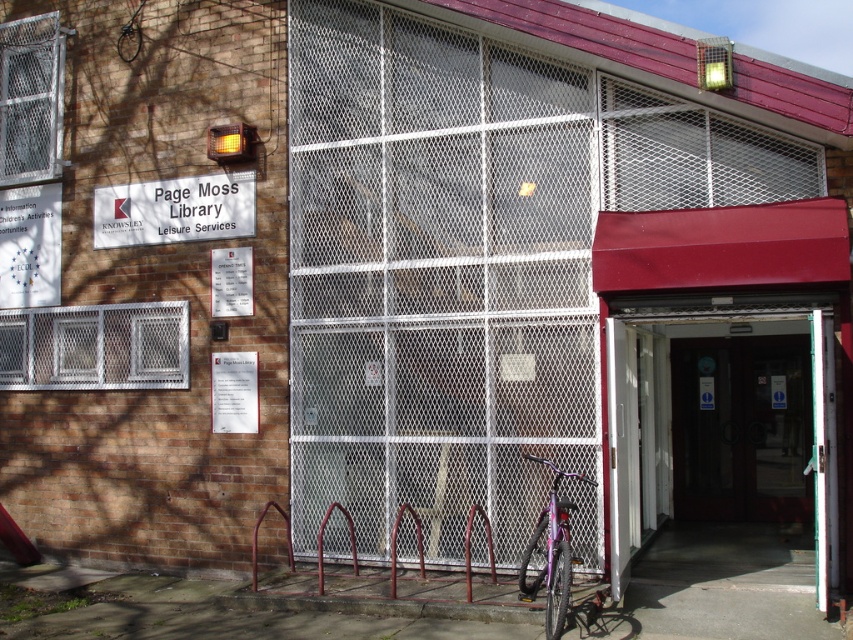
Question: From the image, what is the correct spatial relationship of white plastic sign at upper left in relation to matte purple bicycle at lower center?

Choices:
 (A) above
 (B) below

Answer: (A)

Question: Which object appears closest to the camera in this image?

Choices:
 (A) white plastic sign at upper left
 (B) matte purple bicycle at lower center

Answer: (B)

Question: Considering the relative positions of white plastic sign at upper left and matte purple bicycle at lower center in the image provided, where is white plastic sign at upper left located with respect to matte purple bicycle at lower center?

Choices:
 (A) below
 (B) above

Answer: (B)

Question: Which of the following is the farthest from the observer?

Choices:
 (A) matte purple bicycle at lower center
 (B) white plastic sign at upper left

Answer: (B)

Question: Can you confirm if white plastic sign at upper left is positioned to the left of matte purple bicycle at lower center?

Choices:
 (A) yes
 (B) no

Answer: (A)